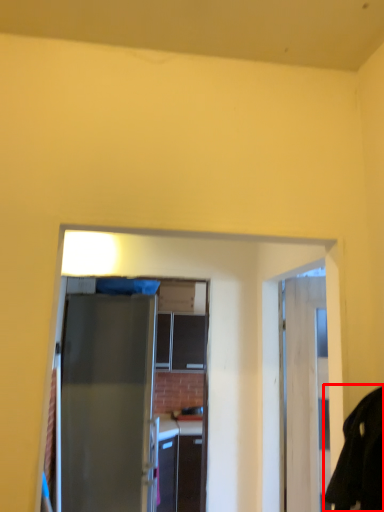
Question: From the image, what is the correct spatial relationship of robe (annotated by the red box) in relation to door?

Choices:
 (A) left
 (B) right

Answer: (B)